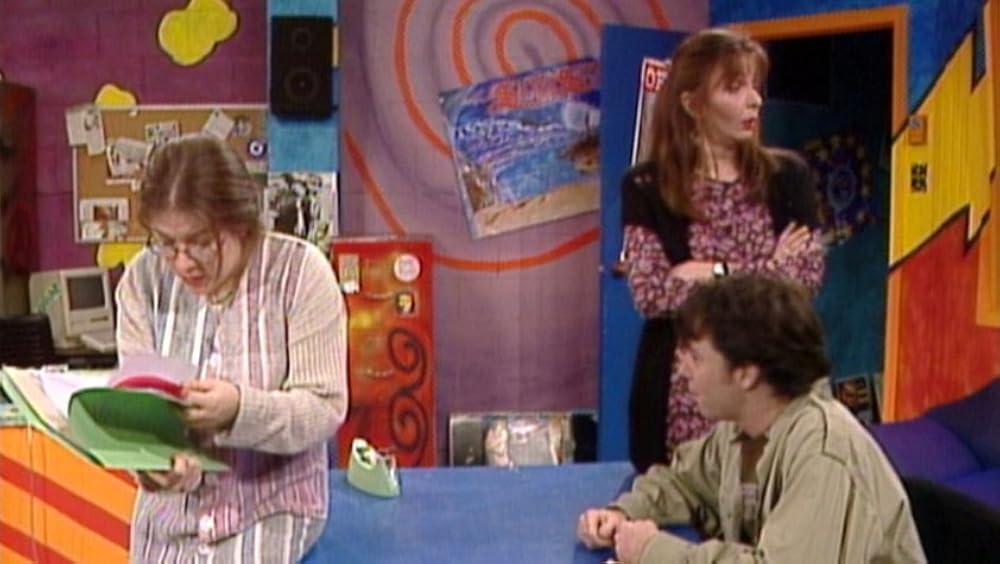
Where is `papers`? The width and height of the screenshot is (1000, 564). papers is located at coordinates (156, 365), (67, 378), (39, 398).